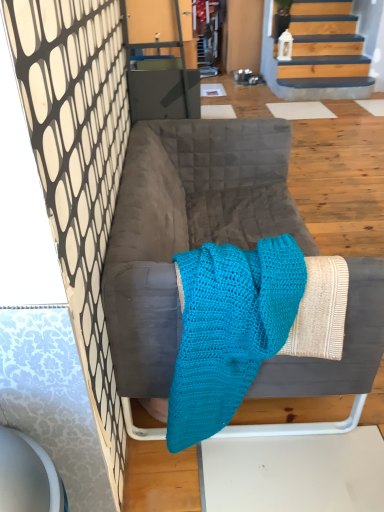
Question: Is velvet gray sofa at center thinner than turquoise knitted blanket at center?

Choices:
 (A) yes
 (B) no

Answer: (B)

Question: Considering the relative sizes of velvet gray sofa at center and turquoise knitted blanket at center in the image provided, is velvet gray sofa at center shorter than turquoise knitted blanket at center?

Choices:
 (A) yes
 (B) no

Answer: (B)

Question: From the image's perspective, is velvet gray sofa at center on turquoise knitted blanket at center?

Choices:
 (A) no
 (B) yes

Answer: (B)

Question: Is velvet gray sofa at center placed right next to turquoise knitted blanket at center?

Choices:
 (A) no
 (B) yes

Answer: (A)

Question: Is velvet gray sofa at center positioned behind turquoise knitted blanket at center?

Choices:
 (A) no
 (B) yes

Answer: (B)

Question: Can you confirm if velvet gray sofa at center is taller than turquoise knitted blanket at center?

Choices:
 (A) yes
 (B) no

Answer: (A)

Question: Is turquoise knitted blanket at center outside velvet gray sofa at center?

Choices:
 (A) no
 (B) yes

Answer: (A)

Question: Is turquoise knitted blanket at center shorter than velvet gray sofa at center?

Choices:
 (A) no
 (B) yes

Answer: (B)

Question: Can velvet gray sofa at center be found inside turquoise knitted blanket at center?

Choices:
 (A) yes
 (B) no

Answer: (B)

Question: Is turquoise knitted blanket at center positioned with its back to velvet gray sofa at center?

Choices:
 (A) yes
 (B) no

Answer: (A)

Question: Are turquoise knitted blanket at center and velvet gray sofa at center making contact?

Choices:
 (A) yes
 (B) no

Answer: (B)

Question: Does turquoise knitted blanket at center have a greater width compared to velvet gray sofa at center?

Choices:
 (A) no
 (B) yes

Answer: (A)

Question: Is turquoise knitted blanket at center wider or thinner than velvet gray sofa at center?

Choices:
 (A) wide
 (B) thin

Answer: (B)